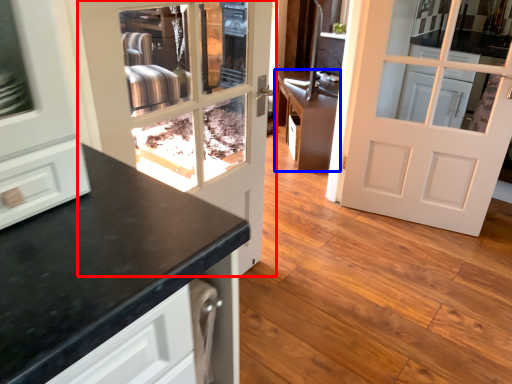
Question: Which object is further to the camera taking this photo, door (highlighted by a red box) or cabinetry (highlighted by a blue box)?

Choices:
 (A) door
 (B) cabinetry

Answer: (B)